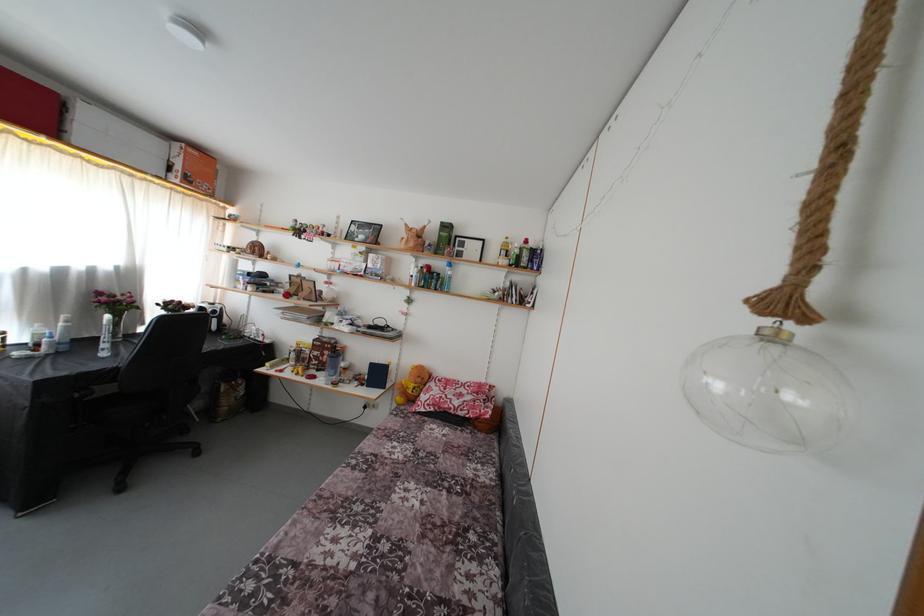
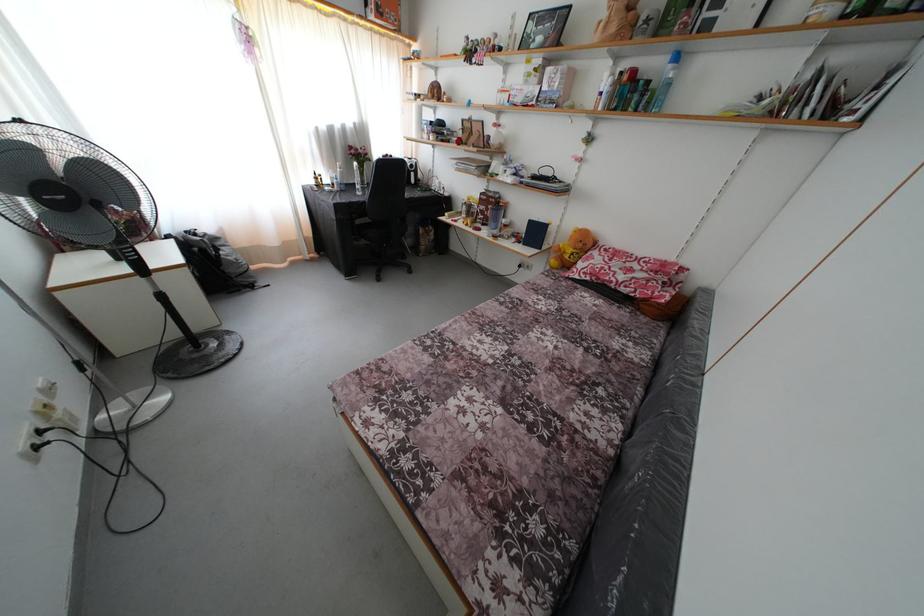
The point at (453, 274) is marked in the first image. Where is the corresponding point in the second image?

(675, 73)